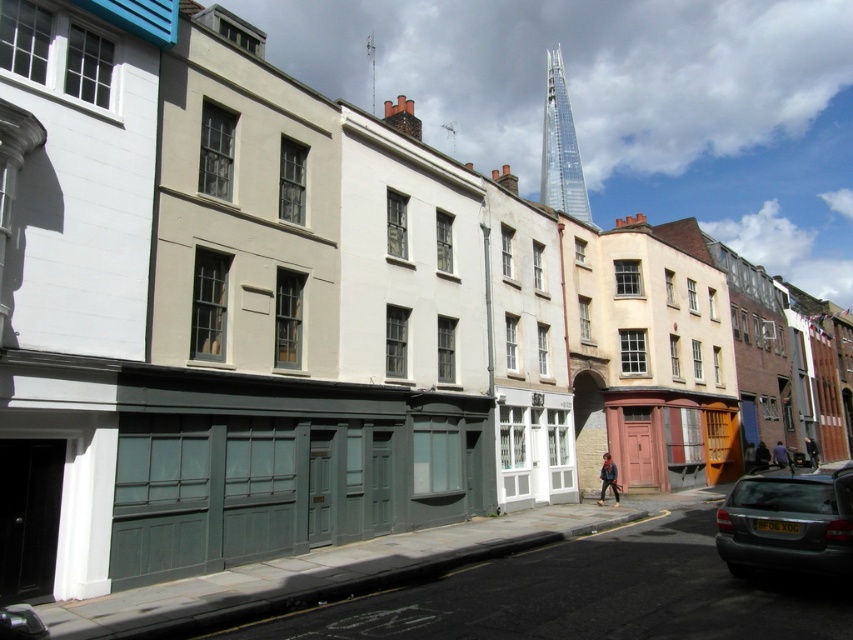
Question: Can you confirm if matte gray car at lower right is bigger than transparent glass spire at upper center?

Choices:
 (A) no
 (B) yes

Answer: (A)

Question: Which object is closer to the camera taking this photo?

Choices:
 (A) matte gray car at lower right
 (B) transparent glass spire at upper center

Answer: (A)

Question: Does matte gray car at lower right appear under transparent glass spire at upper center?

Choices:
 (A) no
 (B) yes

Answer: (B)

Question: Can you confirm if matte gray car at lower right is positioned below transparent glass spire at upper center?

Choices:
 (A) no
 (B) yes

Answer: (B)